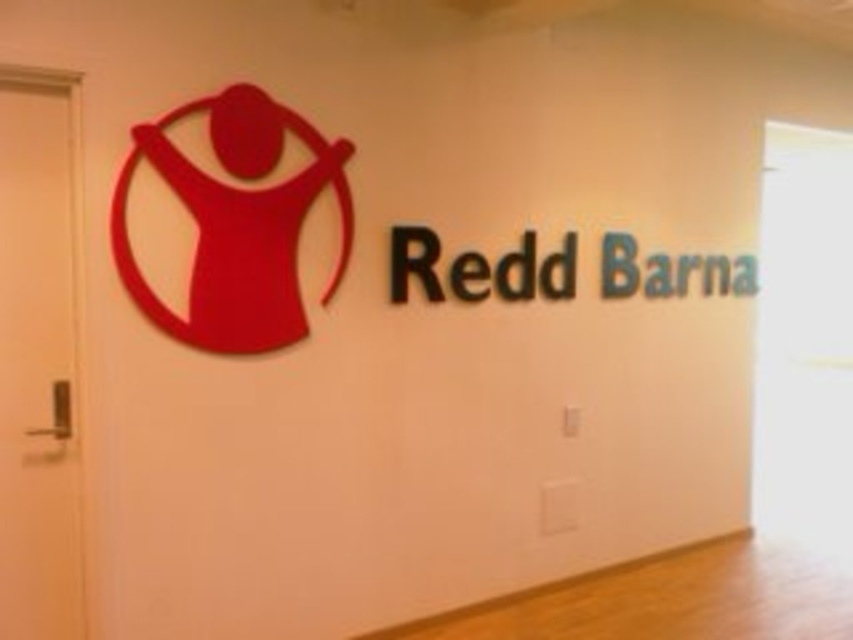
You are designing a poster for a company and need to ensure that the matte red logo at upper left and the green matte barna at upper right are visible from a distance. Which one of these two objects should you consider resizing if you want both to be equally noticeable? Explain your reasoning based on their current sizes.

The matte red logo at upper left is currently larger than the green matte barna at upper right. To make both equally noticeable, you should resize the green matte barna at upper right to be larger, matching the size of the matte red logo at upper left.

You are standing in front of the wall with the logo and text. The logo is at point (236,221). If you want to touch the logo, should you reach to your left or right?

The matte red logo at upper left is represented by point (236,221), so you should reach to your left to touch it.